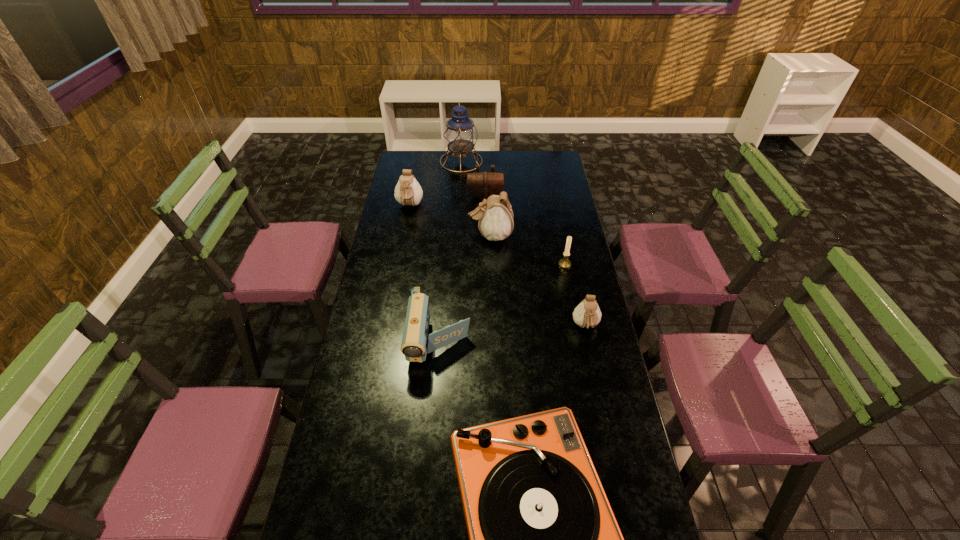
The image size is (960, 540). In order to click on the rightmost pouch in this screenshot , I will do `click(587, 314)`.

The width and height of the screenshot is (960, 540). I want to click on vacant region located 0.060m on the front-facing side of the lantern, so click(493, 161).

Locate an element on the screen. vacant space located on the front-facing side of the second white pouch from left to right is located at coordinates (414, 235).

This screenshot has width=960, height=540. In order to click on vacant space situated on the front-facing side of the second white pouch from left to right in this screenshot , I will do `click(453, 235)`.

Where is `vacant region located 0.270m on the front-facing side of the second white pouch from left to right`? The image size is (960, 540). vacant region located 0.270m on the front-facing side of the second white pouch from left to right is located at coordinates (409, 235).

This screenshot has height=540, width=960. I want to click on vacant area situated on the front-facing side of the leftmost object, so click(x=405, y=231).

Identify the location of vacant point located 0.370m with the flap open on the brown pouch. (486, 252).

Where is `vacant point located on the left of the candle holder`? vacant point located on the left of the candle holder is located at coordinates click(x=483, y=265).

This screenshot has height=540, width=960. Find the location of `free space located on the side of the camcorder with the flip-out screen`. free space located on the side of the camcorder with the flip-out screen is located at coordinates (431, 450).

Identify the location of vacant region located 0.080m on the front-facing side of the smallest white pouch. Image resolution: width=960 pixels, height=540 pixels. (592, 358).